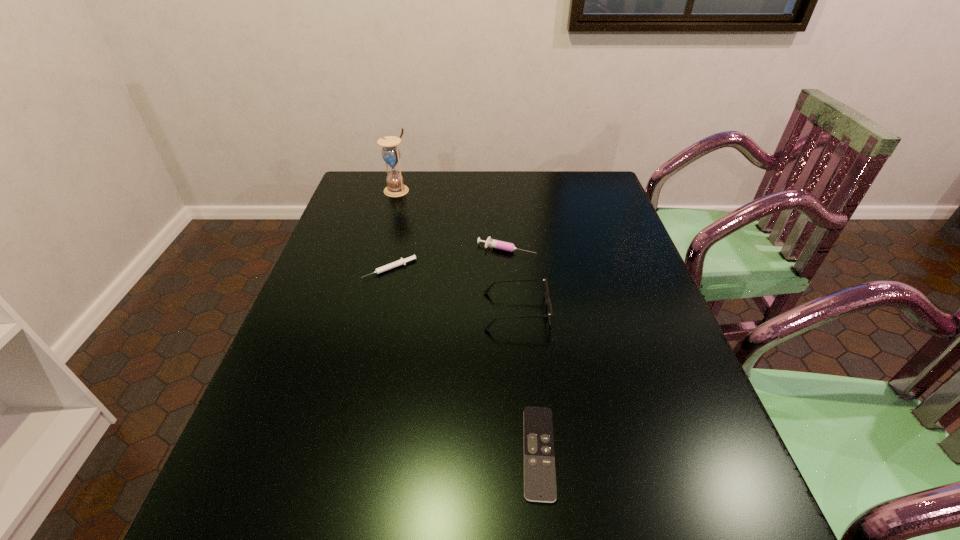
Find the location of `free spot located on the left of the hourglass`. free spot located on the left of the hourglass is located at coordinates (359, 190).

At what (x,y) coordinates should I click in order to perform the action: click on vacant region located 0.060m with the lenses facing outward on the second nearest object. Please return your answer as a coordinate pair (x, y). This screenshot has height=540, width=960. Looking at the image, I should click on (460, 311).

This screenshot has width=960, height=540. What are the coordinates of `free space located with the lenses facing outward on the second nearest object` in the screenshot? It's located at (365, 311).

Where is `vacant point located with the lenses facing outward on the second nearest object`? vacant point located with the lenses facing outward on the second nearest object is located at coordinates (348, 311).

Locate an element on the screen. This screenshot has height=540, width=960. vacant space located 0.310m on the left of the third shortest object is located at coordinates (372, 249).

The image size is (960, 540). Find the location of `vacant region located on the left of the shorter syringe`. vacant region located on the left of the shorter syringe is located at coordinates (326, 269).

What are the coordinates of `blank space located 0.340m on the back of the shortest object` in the screenshot? It's located at (522, 295).

Find the location of `object that is at the far edge`. object that is at the far edge is located at coordinates (391, 154).

Where is `hourglass located in the left edge section of the desktop`? The image size is (960, 540). hourglass located in the left edge section of the desktop is located at coordinates (391, 154).

Where is `syringe located in the left edge section of the desktop`? syringe located in the left edge section of the desktop is located at coordinates (402, 261).